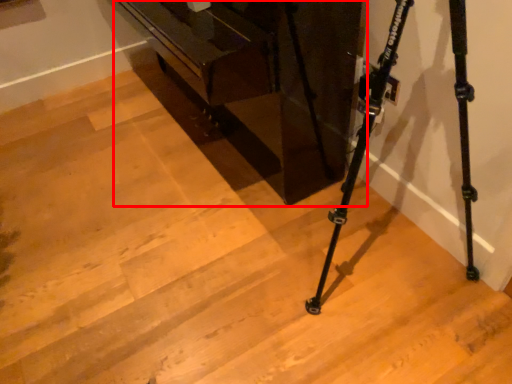
Question: From the image's perspective, where is furniture (annotated by the red box) located relative to tripod?

Choices:
 (A) above
 (B) below

Answer: (A)